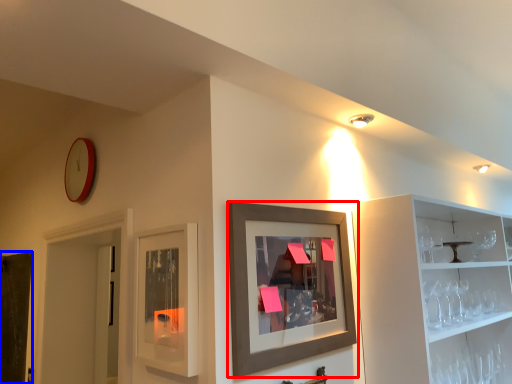
Question: Which object is closer to the camera taking this photo, picture frame (highlighted by a red box) or door (highlighted by a blue box)?

Choices:
 (A) picture frame
 (B) door

Answer: (A)